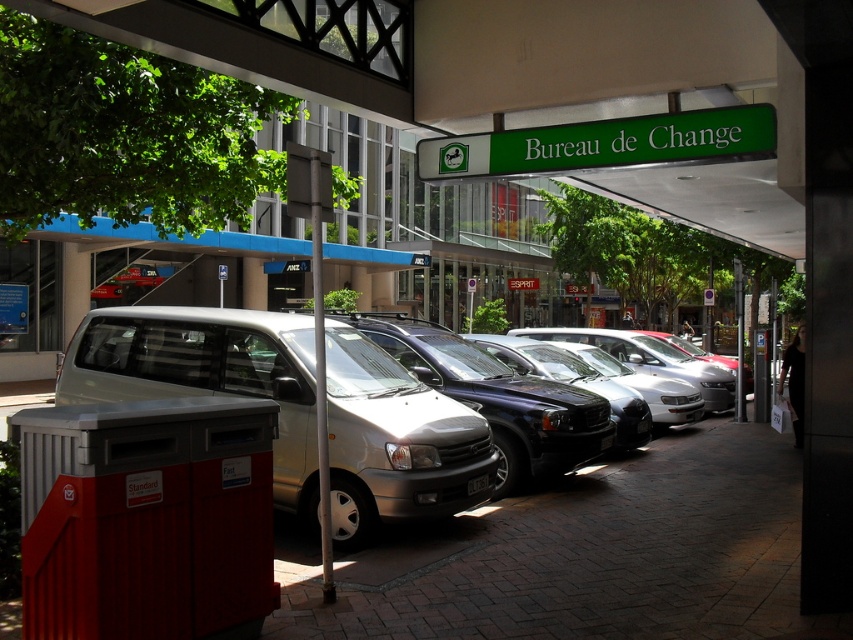
Question: Which of the following is the farthest from the observer?

Choices:
 (A) (x=357, y=420)
 (B) (x=459, y=164)

Answer: (B)

Question: Is silver metallic van at center smaller than green plastic sign at upper center?

Choices:
 (A) no
 (B) yes

Answer: (B)

Question: Does silver metallic van at center appear on the left side of green plastic sign at upper center?

Choices:
 (A) yes
 (B) no

Answer: (A)

Question: Does silver metallic van at center appear on the right side of green plastic sign at upper center?

Choices:
 (A) no
 (B) yes

Answer: (A)